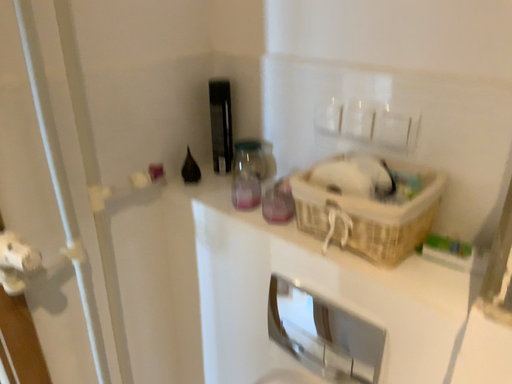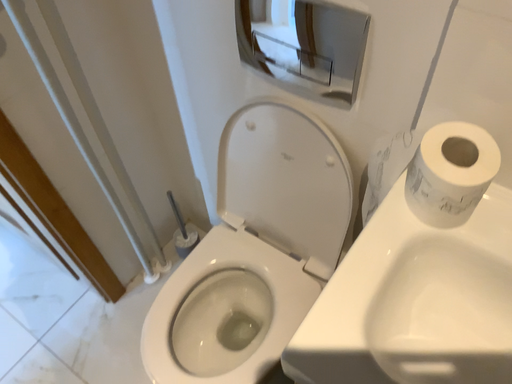
Question: How did the camera likely rotate when shooting the video?

Choices:
 (A) rotated upward
 (B) rotated downward

Answer: (B)